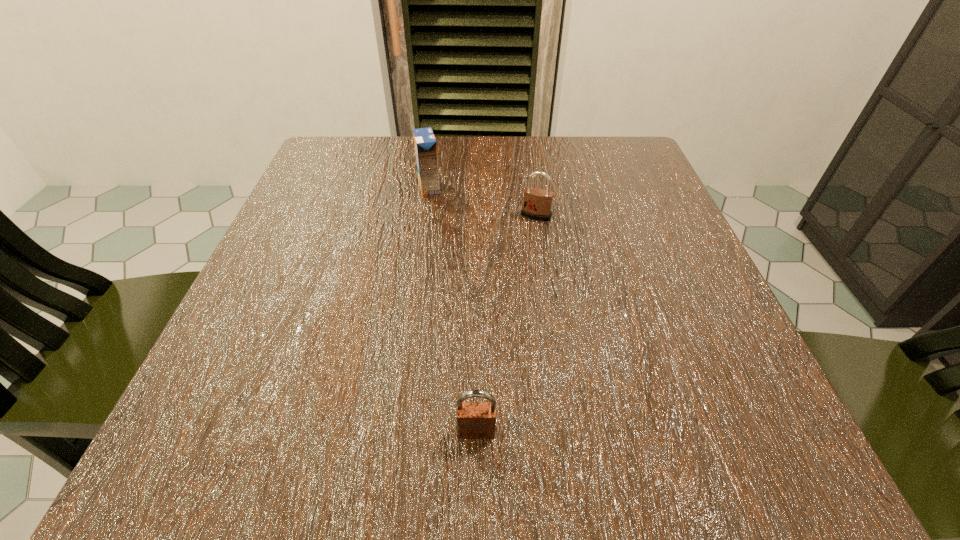
The image size is (960, 540). Find the location of `the leftmost object`. the leftmost object is located at coordinates (425, 144).

You are a GUI agent. You are given a task and a screenshot of the screen. Output one action in this format:
    pyautogui.click(x=<x>, y=<y>)
    Task: Click on the farthest object
    The width and height of the screenshot is (960, 540).
    Given the screenshot: What is the action you would take?
    pyautogui.click(x=425, y=144)

Where is `the right padlock`? The width and height of the screenshot is (960, 540). the right padlock is located at coordinates (537, 202).

Image resolution: width=960 pixels, height=540 pixels. I want to click on the farther padlock, so click(537, 202).

This screenshot has width=960, height=540. In order to click on the second object from left to right in this screenshot , I will do `click(475, 420)`.

This screenshot has height=540, width=960. I want to click on the nearest object, so click(475, 420).

The height and width of the screenshot is (540, 960). In order to click on vacant space located on the left of the tallest object in this screenshot , I will do `click(369, 187)`.

Where is `vacant point located 0.310m on the front of the right padlock`? The width and height of the screenshot is (960, 540). vacant point located 0.310m on the front of the right padlock is located at coordinates (558, 360).

Locate an element on the screen. vacant space located on the front-facing side of the nearer padlock is located at coordinates (476, 482).

Identify the location of object situated at the far edge. (425, 144).